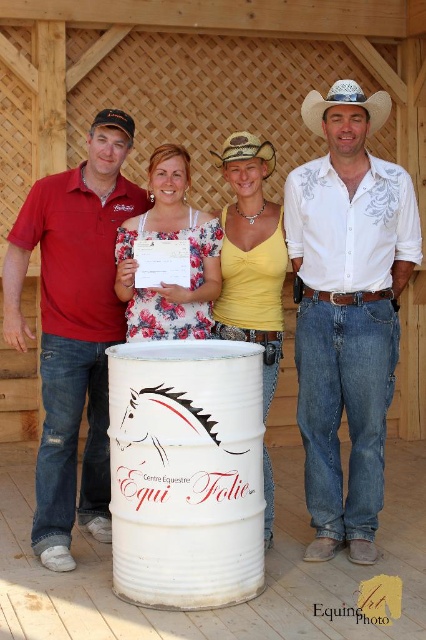
Question: Does white straw cowboy hat at upper center come behind braided straw cowboy hat at center?

Choices:
 (A) no
 (B) yes

Answer: (A)

Question: Which is farther from the floral fabric shirt at center?

Choices:
 (A) yellow matte tank top at center
 (B) white straw cowboy hat at upper center

Answer: (B)

Question: Based on their relative distances, which object is farther from the white matte barrel at center?

Choices:
 (A) yellow matte tank top at center
 (B) white straw cowboy hat at upper center
 (C) floral fabric shirt at center

Answer: (B)

Question: Is matte red polo shirt at left thinner than braided straw cowboy hat at center?

Choices:
 (A) yes
 (B) no

Answer: (B)

Question: Can you confirm if floral fabric shirt at center is smaller than braided straw cowboy hat at center?

Choices:
 (A) no
 (B) yes

Answer: (A)

Question: Considering the real-world distances, which object is closest to the floral fabric shirt at center?

Choices:
 (A) white straw cowboy hat at upper center
 (B) yellow matte tank top at center
 (C) white embroidered shirt at center

Answer: (B)